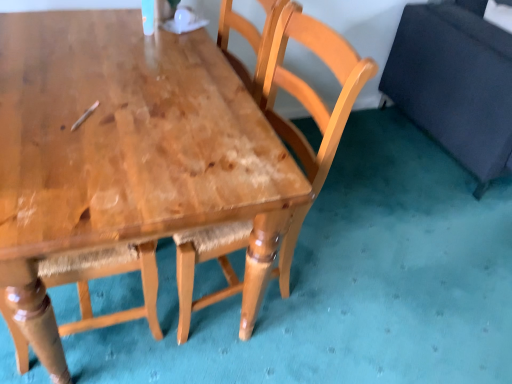
Identify the location of shiny brown wood table at center. (122, 149).

In order to face wooden chair at center, should I rotate leftwards or rightwards?

You should rotate left by 2.704 degrees.

Image resolution: width=512 pixels, height=384 pixels. What are the coordinates of `shiny brown wood table at center` in the screenshot? It's located at pos(122,149).

Can you confirm if wooden chair at center is positioned to the left of dark blue fabric swivel chair at right?

Yes.

Is wooden chair at center taller or shorter than dark blue fabric swivel chair at right?

Considering their sizes, wooden chair at center has more height than dark blue fabric swivel chair at right.

From a real-world perspective, is wooden chair at center positioned over dark blue fabric swivel chair at right based on gravity?

Indeed, from a real-world perspective, wooden chair at center stands above dark blue fabric swivel chair at right.

In terms of width, does wooden chair at center look wider or thinner when compared to dark blue fabric swivel chair at right?

In the image, wooden chair at center appears to be more narrow than dark blue fabric swivel chair at right.

In the image, is dark blue fabric swivel chair at right on the left side or the right side of wooden chair at center?

Clearly, dark blue fabric swivel chair at right is on the right of wooden chair at center in the image.

Considering the relative sizes of dark blue fabric swivel chair at right and wooden chair at center in the image provided, is dark blue fabric swivel chair at right smaller than wooden chair at center?

Incorrect, dark blue fabric swivel chair at right is not smaller in size than wooden chair at center.

Which of these two, dark blue fabric swivel chair at right or wooden chair at center, stands taller?

With more height is wooden chair at center.

From a real-world perspective, is shiny brown wood table at center under wooden chair at center?

Yes, from a real-world perspective, shiny brown wood table at center is beneath wooden chair at center.

Between point (193, 88) and point (321, 58), which one is positioned behind?

The point (321, 58) is farther.

In the scene shown: Between shiny brown wood table at center and wooden chair at center, which one has smaller size?

shiny brown wood table at center.

Is shiny brown wood table at center positioned with its back to wooden chair at center?

Absolutely, shiny brown wood table at center is directed away from wooden chair at center.

You are a GUI agent. You are given a task and a screenshot of the screen. Output one action in this format:
    pyautogui.click(x=<x>, y=<y>)
    Task: Click on the table below the wooden chair at center (from a real-world perspective)
    The image size is (512, 384).
    Given the screenshot: What is the action you would take?
    pyautogui.click(x=122, y=149)

From the image's perspective, who appears lower, wooden chair at center or shiny brown wood table at center?

From the image's view, shiny brown wood table at center is below.

Is wooden chair at center inside or outside of shiny brown wood table at center?

wooden chair at center cannot be found inside shiny brown wood table at center.

Which object is closer to the camera, wooden chair at center or shiny brown wood table at center?

shiny brown wood table at center is in front.

From a real-world perspective, which object stands above the other?

From a 3D spatial view, shiny brown wood table at center is above.

Is dark blue fabric swivel chair at right smaller than shiny brown wood table at center?

No, dark blue fabric swivel chair at right is not smaller than shiny brown wood table at center.

Are dark blue fabric swivel chair at right and shiny brown wood table at center far apart?

Yes, dark blue fabric swivel chair at right and shiny brown wood table at center are located far from each other.

Which is more to the right, shiny brown wood table at center or dark blue fabric swivel chair at right?

dark blue fabric swivel chair at right is more to the right.

Does shiny brown wood table at center have a lesser width compared to dark blue fabric swivel chair at right?

Indeed, shiny brown wood table at center has a lesser width compared to dark blue fabric swivel chair at right.

Considering the relative sizes of shiny brown wood table at center and dark blue fabric swivel chair at right in the image provided, is shiny brown wood table at center bigger than dark blue fabric swivel chair at right?

Incorrect, shiny brown wood table at center is not larger than dark blue fabric swivel chair at right.

Find the location of a particular element. The width and height of the screenshot is (512, 384). chair above the dark blue fabric swivel chair at right (from a real-world perspective) is located at coordinates (303, 81).

You are a GUI agent. You are given a task and a screenshot of the screen. Output one action in this format:
    pyautogui.click(x=<x>, y=<y>)
    Task: Click on the chair on the left of the dark blue fabric swivel chair at right
    
    Given the screenshot: What is the action you would take?
    pyautogui.click(x=303, y=81)

In the scene shown: From the image, which object appears to be farther from dark blue fabric swivel chair at right, wooden chair at center or shiny brown wood table at center?

shiny brown wood table at center is further to dark blue fabric swivel chair at right.

From the image, which object appears to be farther from shiny brown wood table at center, dark blue fabric swivel chair at right or wooden chair at center?

dark blue fabric swivel chair at right is positioned further to the anchor shiny brown wood table at center.

When comparing their distances from dark blue fabric swivel chair at right, does shiny brown wood table at center or wooden chair at center seem further?

shiny brown wood table at center is further to dark blue fabric swivel chair at right.

Which object lies nearer to the anchor point wooden chair at center, shiny brown wood table at center or dark blue fabric swivel chair at right?

shiny brown wood table at center.

Based on the photo, when comparing their distances from shiny brown wood table at center, does wooden chair at center or dark blue fabric swivel chair at right seem closer?

The object closer to shiny brown wood table at center is wooden chair at center.

Based on their spatial positions, is dark blue fabric swivel chair at right or shiny brown wood table at center further from wooden chair at center?

dark blue fabric swivel chair at right.

Locate an element on the screen. This screenshot has width=512, height=384. chair between shiny brown wood table at center and dark blue fabric swivel chair at right in the horizontal direction is located at coordinates (303, 81).